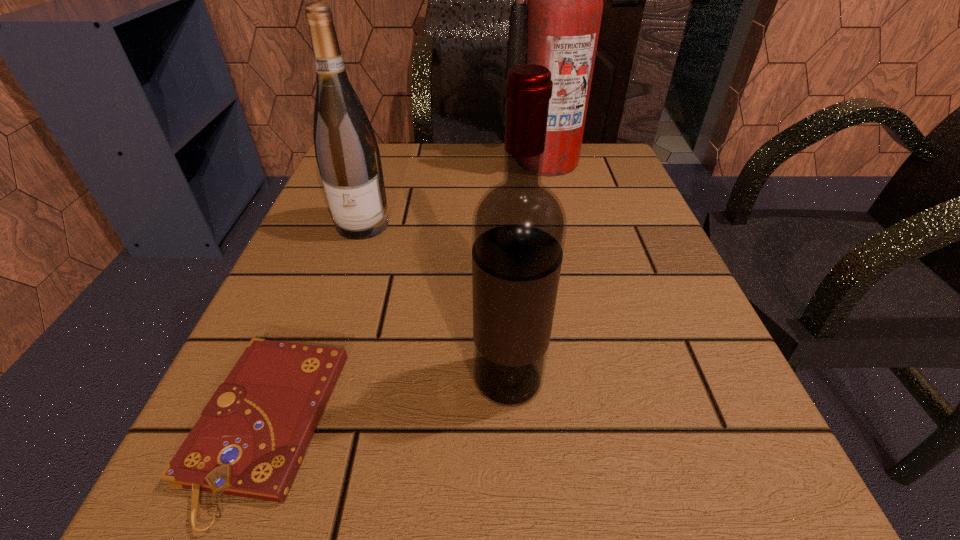
Where is `object that is at the far edge`? This screenshot has height=540, width=960. object that is at the far edge is located at coordinates (558, 28).

At what (x,y) coordinates should I click in order to perform the action: click on object at the near edge. Please return your answer as a coordinate pair (x, y). The width and height of the screenshot is (960, 540). Looking at the image, I should click on (250, 441).

Identify the location of wine bottle located in the left edge section of the desktop. (347, 153).

Locate an element on the screen. The height and width of the screenshot is (540, 960). notebook situated at the left edge is located at coordinates (250, 441).

The image size is (960, 540). Identify the location of object that is positioned at the right edge. (558, 28).

Identify the location of object that is positioned at the near left corner. (250, 441).

Image resolution: width=960 pixels, height=540 pixels. I want to click on object situated at the far right corner, so click(558, 28).

Find the location of a particular element. The height and width of the screenshot is (540, 960). free space at the far edge of the desktop is located at coordinates (422, 166).

Identify the location of vacant space at the left edge. Image resolution: width=960 pixels, height=540 pixels. (325, 424).

The image size is (960, 540). I want to click on free spot at the right edge of the desktop, so click(639, 282).